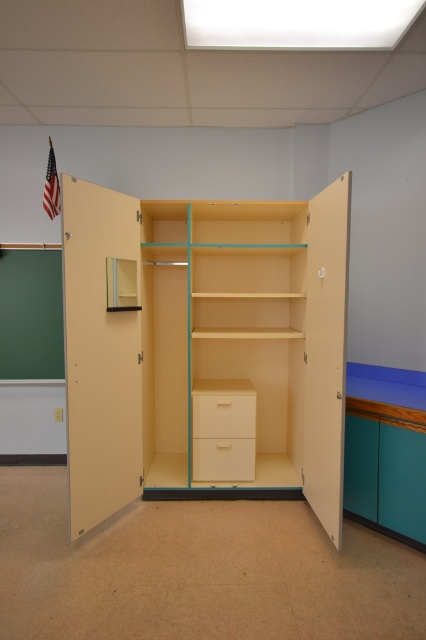
You are organizing supplies in a classroom and need to place a large box that requires a lot of space. Which drawer should you choose between the matte white drawer at center and the matte wood drawer at center?

The matte white drawer at center has a larger size compared to the matte wood drawer at center, so you should choose the matte white drawer at center for the large box.

You are a teacher organizing supplies in the classroom. You have a large poster that needs to be stored vertically. Given the green matte chalkboard at left and the matte white drawer at center, which object can accommodate the poster based on their height?

The green matte chalkboard at left is much taller than the matte white drawer at center, so the poster can be stored vertically on the green matte chalkboard at left.

Consider the image. You are a teacher who needs to reach both the green matte chalkboard at left and the matte cream drawer at center. If your maximum reaching distance is 5 feet, can you comfortably reach both without moving your position?

The green matte chalkboard at left is 4.76 feet away from matte cream drawer at center. Since your maximum reaching distance is 5 feet, you can comfortably reach both objects without moving your position as the distance between them is within your reach.